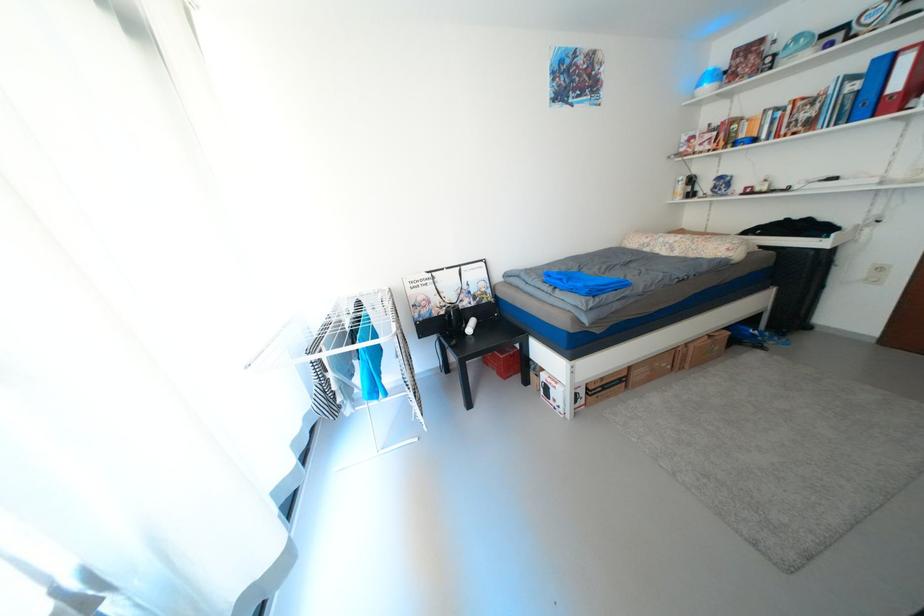
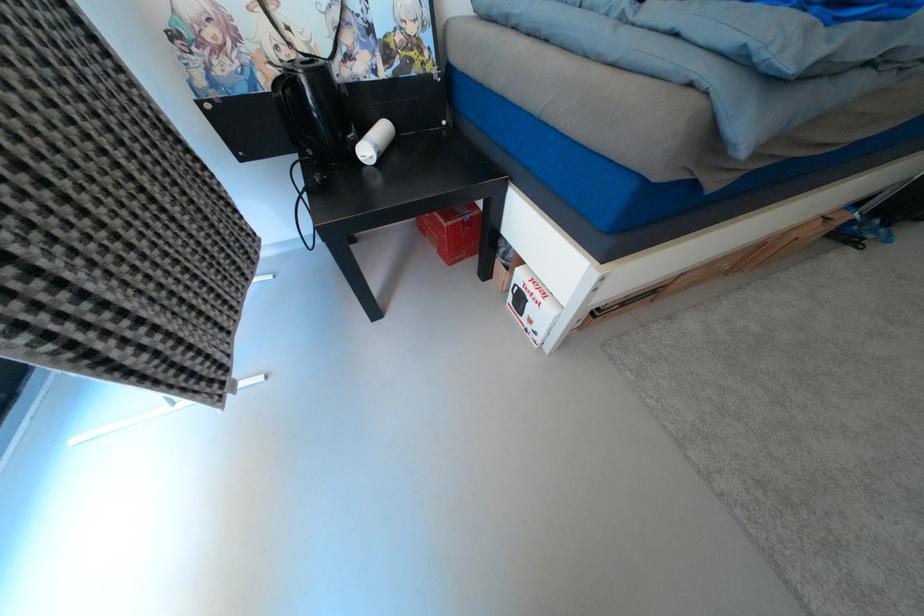
Where in the second image is the point corresponding to (x=551, y=376) from the first image?

(528, 273)